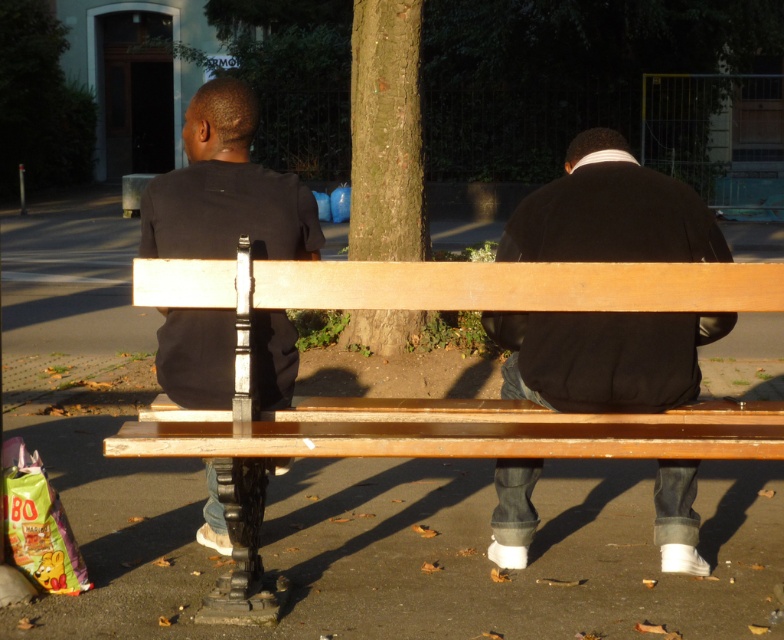
Question: Which point is closer to the camera?

Choices:
 (A) matte black jacket at center
 (B) green rough bark at center
 (C) black matte shirt at left
 (D) green leafy tree at upper left

Answer: (C)

Question: Does green rough bark at center have a greater width compared to green leafy tree at upper left?

Choices:
 (A) no
 (B) yes

Answer: (A)

Question: Which of the following is the farthest from the observer?

Choices:
 (A) (677, 365)
 (B) (282, 209)
 (C) (376, 104)
 (D) (641, 406)

Answer: (C)

Question: Can you confirm if black matte jacket at center is positioned above green rough bark at center?

Choices:
 (A) no
 (B) yes

Answer: (A)

Question: Which object appears closest to the camera in this image?

Choices:
 (A) black matte shirt at left
 (B) green rough bark at center
 (C) green leafy tree at upper left
 (D) black matte jacket at center

Answer: (A)

Question: In this image, where is black matte jacket at center located relative to black matte shirt at left?

Choices:
 (A) left
 (B) right

Answer: (B)